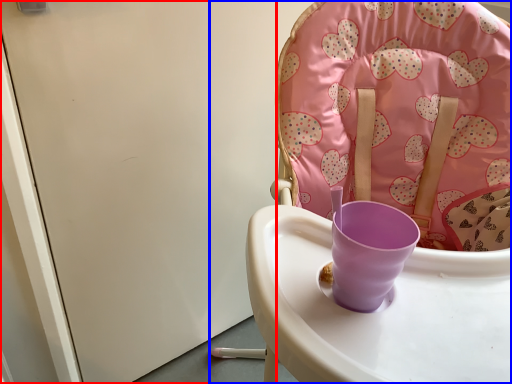
Question: Which object is closer to the camera taking this photo, screen door (highlighted by a red box) or chair (highlighted by a blue box)?

Choices:
 (A) screen door
 (B) chair

Answer: (B)